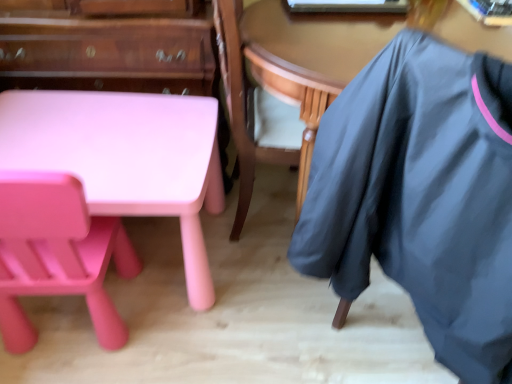
Question: Are wooden table at center and dark gray fabric at right located far from each other?

Choices:
 (A) yes
 (B) no

Answer: (B)

Question: Could you tell me if wooden table at center is facing dark gray fabric at right?

Choices:
 (A) no
 (B) yes

Answer: (A)

Question: From a real-world perspective, is wooden table at center below dark gray fabric at right?

Choices:
 (A) no
 (B) yes

Answer: (B)

Question: Is the position of wooden table at center less distant than that of dark gray fabric at right?

Choices:
 (A) no
 (B) yes

Answer: (A)

Question: Does wooden table at center appear on the left side of dark gray fabric at right?

Choices:
 (A) yes
 (B) no

Answer: (A)

Question: From the image's perspective, is matte pink plastic desk at lower left positioned above or below matte pink table at lower left?

Choices:
 (A) above
 (B) below

Answer: (B)

Question: Considering the positions of matte pink plastic desk at lower left and matte pink table at lower left in the image, is matte pink plastic desk at lower left bigger or smaller than matte pink table at lower left?

Choices:
 (A) small
 (B) big

Answer: (A)

Question: In terms of height, does matte pink plastic desk at lower left look taller or shorter compared to matte pink table at lower left?

Choices:
 (A) short
 (B) tall

Answer: (A)

Question: Is matte pink plastic desk at lower left to the left or to the right of matte pink table at lower left in the image?

Choices:
 (A) left
 (B) right

Answer: (B)

Question: Based on their sizes in the image, would you say matte pink chair at lower left is bigger or smaller than dark gray fabric at right?

Choices:
 (A) big
 (B) small

Answer: (B)

Question: From a real-world perspective, relative to dark gray fabric at right, is matte pink chair at lower left vertically above or below?

Choices:
 (A) below
 (B) above

Answer: (A)

Question: Considering the positions of matte pink chair at lower left and dark gray fabric at right in the image, is matte pink chair at lower left wider or thinner than dark gray fabric at right?

Choices:
 (A) wide
 (B) thin

Answer: (B)

Question: Is point (31, 337) positioned closer to the camera than point (377, 66)?

Choices:
 (A) farther
 (B) closer

Answer: (A)

Question: Is point (202, 289) closer or farther from the camera than point (434, 31)?

Choices:
 (A) farther
 (B) closer

Answer: (A)

Question: In terms of height, does matte pink plastic desk at lower left look taller or shorter compared to wooden table at center?

Choices:
 (A) tall
 (B) short

Answer: (B)